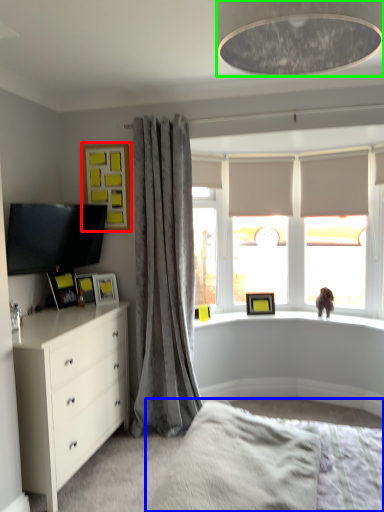
Question: Which is farther away from picture frame (highlighted by a red box)? bed frame (highlighted by a blue box) or light fixture (highlighted by a green box)?

Choices:
 (A) bed frame
 (B) light fixture

Answer: (B)